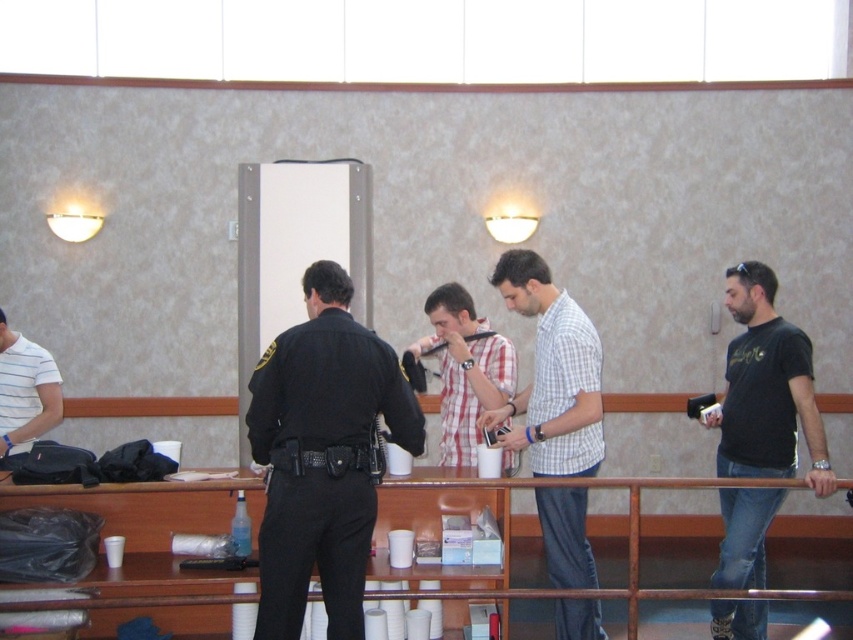
You are standing in front of the counter and want to see both the plaid cotton shirt at center and the white striped shirt at left. Which shirt is closer to you?

The plaid cotton shirt at center is closer to you because it is in front of the white striped shirt at left.